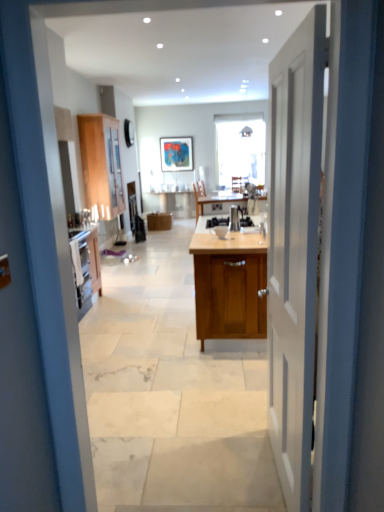
Locate an element on the screen. The height and width of the screenshot is (512, 384). blank area to the left of white wooden door at center is located at coordinates (201, 468).